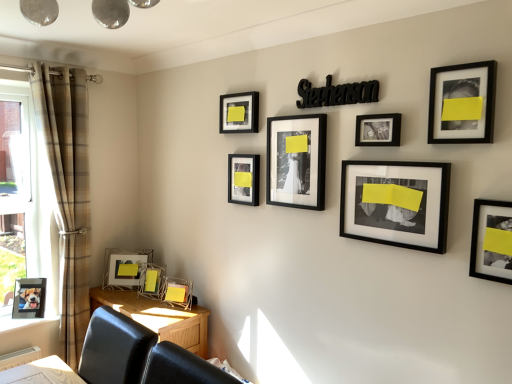
In order to click on empty space that is ontop of brown plaid curtain at left (from a real-world perspective) in this screenshot , I will do `click(60, 68)`.